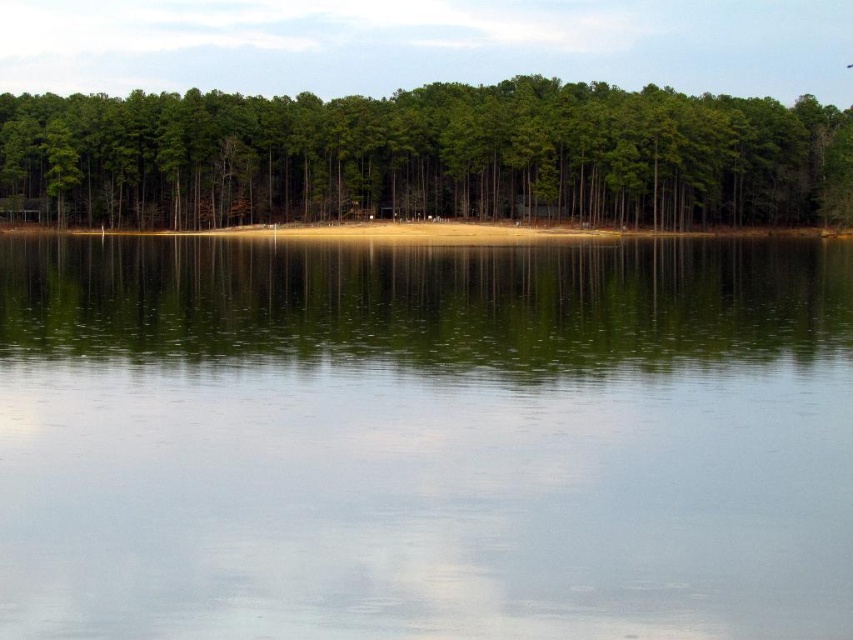
Question: Which point is farther to the camera?

Choices:
 (A) green reflective water at center
 (B) green matte trees at upper center

Answer: (B)

Question: Considering the relative positions of green reflective water at center and green matte trees at upper center in the image provided, where is green reflective water at center located with respect to green matte trees at upper center?

Choices:
 (A) left
 (B) right

Answer: (A)

Question: Does green reflective water at center have a lesser width compared to green matte trees at upper center?

Choices:
 (A) no
 (B) yes

Answer: (B)

Question: Which point is closer to the camera taking this photo?

Choices:
 (A) (222, 221)
 (B) (583, 570)

Answer: (B)

Question: Is green reflective water at center thinner than green matte trees at upper center?

Choices:
 (A) yes
 (B) no

Answer: (A)